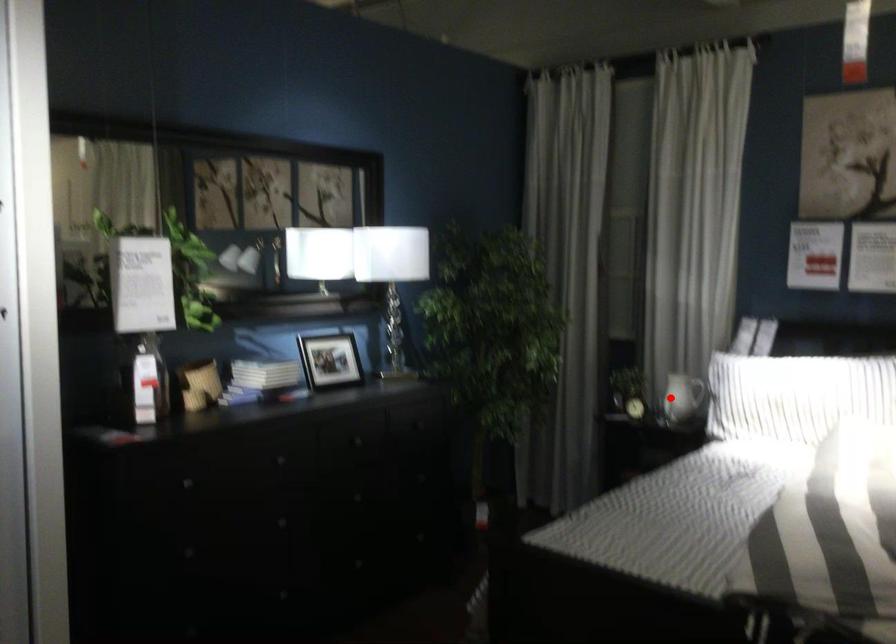
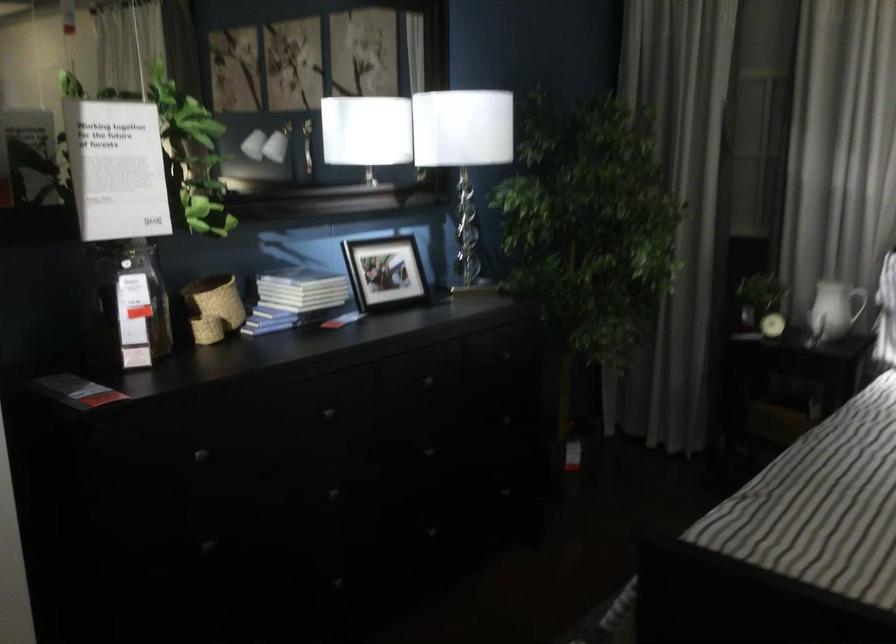
The point at the highlighted location is marked in the first image. Where is the corresponding point in the second image?

(823, 313)